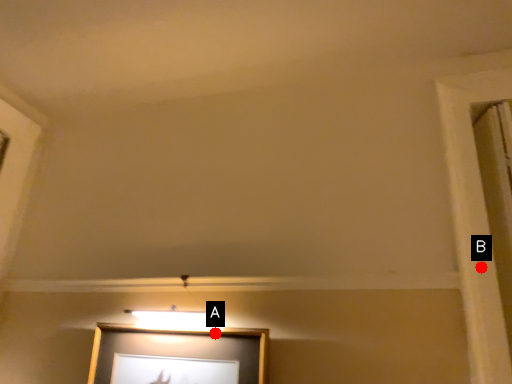
Question: Two points are circled on the image, labeled by A and B beside each circle. Which point appears closest to the camera in this image?

Choices:
 (A) A is closer
 (B) B is closer

Answer: (B)